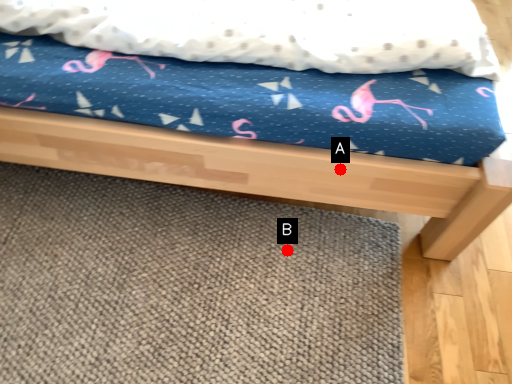
Question: Two points are circled on the image, labeled by A and B beside each circle. Which point is closer to the camera?

Choices:
 (A) A is closer
 (B) B is closer

Answer: (A)